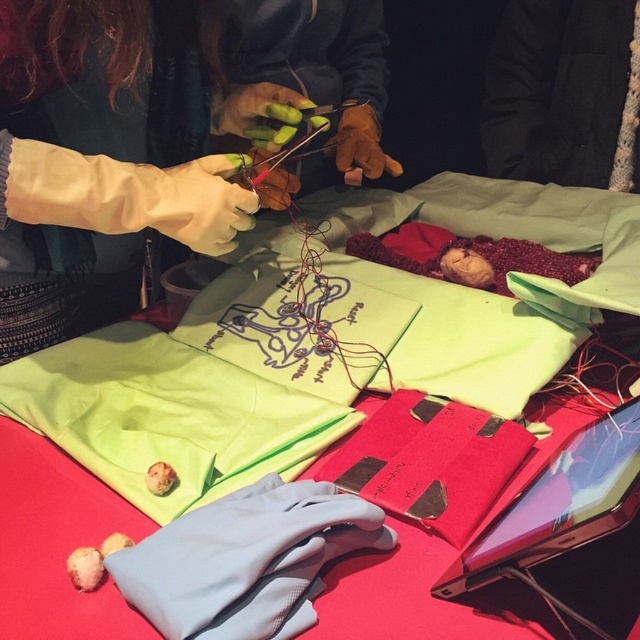
You are organizing a craft fair and need to display both the green fabric at center and the black fabric at upper right. Which fabric should you choose if you want to display the larger one?

The black fabric at upper right is larger than the green fabric at center, so you should choose the black fabric at upper right for display.

Looking at this image, you are organizing a craft fair and need to display two fabrics. The green fabric at center and the black fabric at upper right must be placed on a shelf that can only hold items up to 1 meter in width. Which fabric should you choose to ensure it fits on the shelf?

The black fabric at upper right should be chosen because its width is smaller than the green fabric at center, making it more likely to fit within the 1 meter limit.